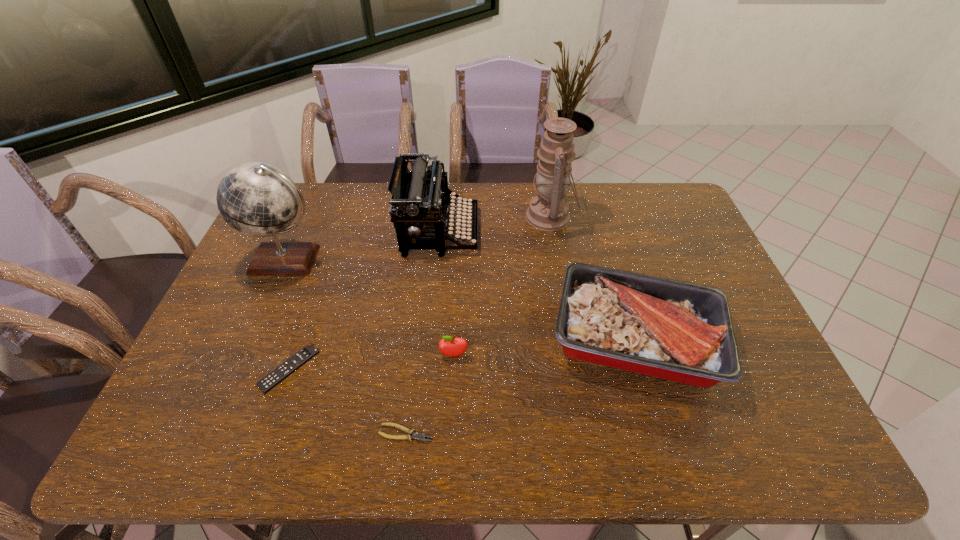
The width and height of the screenshot is (960, 540). In order to click on free point located 0.390m on the left of the tray in this screenshot , I will do click(x=402, y=338).

Locate an element on the screen. This screenshot has height=540, width=960. vacant position located 0.070m on the front of the fifth tallest object is located at coordinates (452, 384).

Where is `vacant region located 0.140m on the right of the remote control`? This screenshot has width=960, height=540. vacant region located 0.140m on the right of the remote control is located at coordinates (371, 368).

You are a GUI agent. You are given a task and a screenshot of the screen. Output one action in this format:
    pyautogui.click(x=<x>, y=<y>)
    Task: Click on the vacant space located 0.380m on the right of the pliers
    
    Given the screenshot: What is the action you would take?
    pyautogui.click(x=602, y=433)

The width and height of the screenshot is (960, 540). I want to click on oil lamp at the far edge, so (x=548, y=211).

Locate an element on the screen. typewriter that is at the far edge is located at coordinates (420, 198).

Find the location of a particular element. Image resolution: width=960 pixels, height=540 pixels. object that is at the near edge is located at coordinates (419, 436).

This screenshot has width=960, height=540. Identify the location of object at the left edge. (256, 199).

Where is `object at the right edge`? Image resolution: width=960 pixels, height=540 pixels. object at the right edge is located at coordinates (678, 331).

Where is `blank area at the far edge`? The width and height of the screenshot is (960, 540). blank area at the far edge is located at coordinates (511, 184).